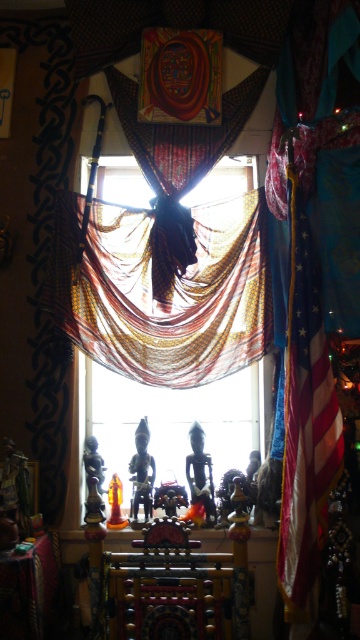
Question: Which object is the closest to the multicolored sheer fabric at center?

Choices:
 (A) transparent fabric at center
 (B) american flag at right

Answer: (A)

Question: Is american flag at right thinner than transparent fabric at center?

Choices:
 (A) no
 (B) yes

Answer: (B)

Question: From the image, what is the correct spatial relationship of american flag at right in relation to transparent fabric at center?

Choices:
 (A) below
 (B) above

Answer: (B)

Question: Does multicolored sheer fabric at center appear under transparent fabric at center?

Choices:
 (A) no
 (B) yes

Answer: (A)

Question: Which object is positioned closest to the american flag at right?

Choices:
 (A) transparent fabric at center
 (B) multicolored sheer fabric at center

Answer: (B)

Question: Which point is farther from the camera taking this photo?

Choices:
 (A) (177, 458)
 (B) (230, 202)

Answer: (A)